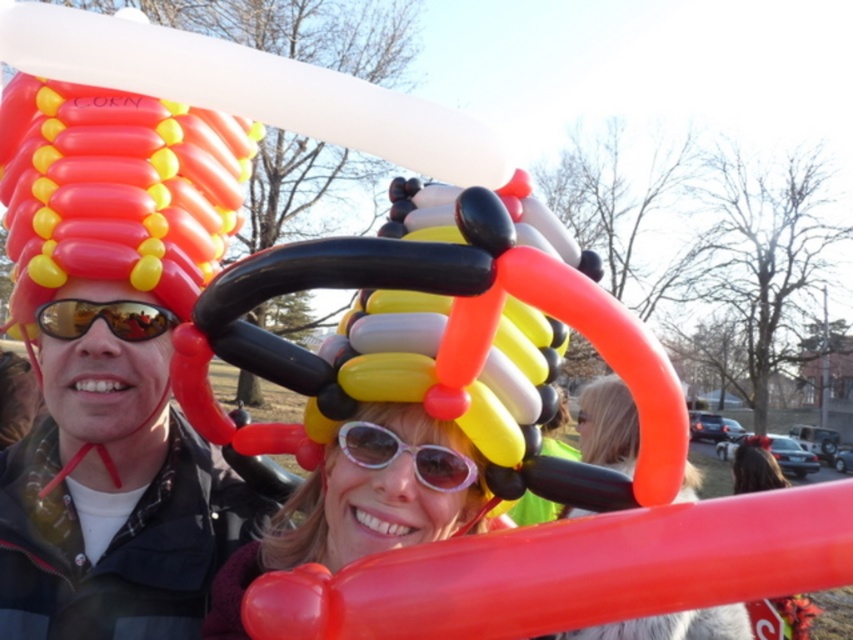
Is point (357, 436) positioned before point (102, 316)?

Yes, point (357, 436) is in front of point (102, 316).

This screenshot has height=640, width=853. Describe the element at coordinates (407, 452) in the screenshot. I see `white glossy sunglasses at center` at that location.

Does point (340, 444) come farther from viewer compared to point (65, 317)?

No, (340, 444) is closer to viewer.

Where is `white glossy sunglasses at center`? This screenshot has width=853, height=640. white glossy sunglasses at center is located at coordinates (407, 452).

Is matte black sunglasses at upper left closer to the viewer compared to matte orange balloon at center?

That is False.

Does point (103, 314) come farther from viewer compared to point (560, 634)?

No.

In order to click on matte black sunglasses at upper left in this screenshot , I will do `click(112, 484)`.

Is point (45, 374) farther from viewer compared to point (131, 317)?

Yes, point (45, 374) is behind point (131, 317).

Is point (27, 506) farther from camera compared to point (74, 336)?

Yes.

The height and width of the screenshot is (640, 853). Find the location of `matte black sunglasses at upper left`. matte black sunglasses at upper left is located at coordinates (112, 484).